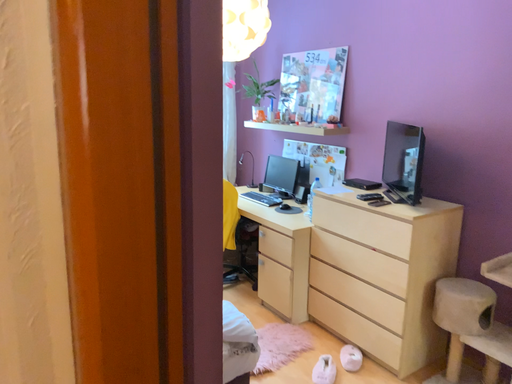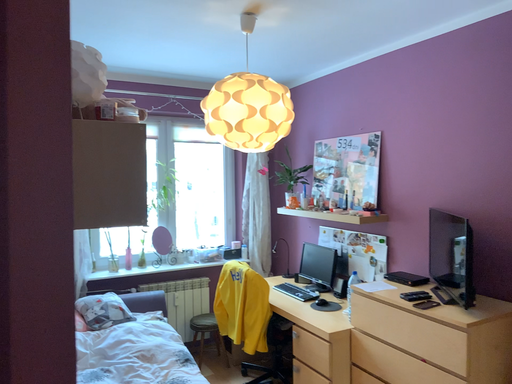
Question: How did the camera likely rotate when shooting the video?

Choices:
 (A) rotated upward
 (B) rotated downward

Answer: (A)